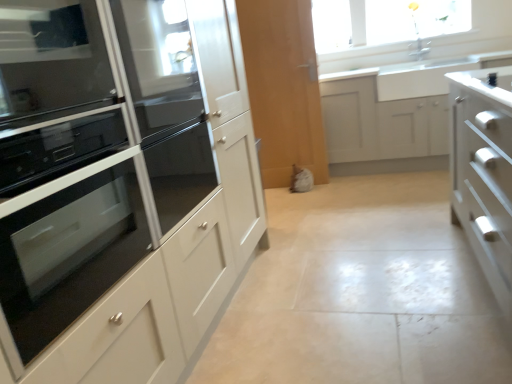
Question: Considering the relative sizes of white ceramic sink at upper right and matte white oven at left, the second cabinetry positioned from the back, in the image provided, is white ceramic sink at upper right smaller than matte white oven at left, the second cabinetry positioned from the back,?

Choices:
 (A) no
 (B) yes

Answer: (B)

Question: From the image's perspective, is white ceramic sink at upper right above matte white oven at left, which is counted as the second cabinetry, starting from the right?

Choices:
 (A) no
 (B) yes

Answer: (B)

Question: Would you consider white ceramic sink at upper right to be distant from matte white oven at left, which is counted as the second cabinetry, starting from the right?

Choices:
 (A) yes
 (B) no

Answer: (A)

Question: Is white ceramic sink at upper right wider than matte white oven at left, the 1th cabinetry from the left?

Choices:
 (A) no
 (B) yes

Answer: (B)

Question: From a real-world perspective, is white ceramic sink at upper right located higher than matte white oven at left, placed as the first cabinetry when sorted from front to back?

Choices:
 (A) no
 (B) yes

Answer: (A)

Question: From their relative heights in the image, would you say black glass oven at left is taller or shorter than black glass oven at left?

Choices:
 (A) tall
 (B) short

Answer: (A)

Question: Relative to black glass oven at left, is black glass oven at left in front or behind?

Choices:
 (A) behind
 (B) front

Answer: (B)

Question: Is black glass oven at left spatially inside black glass oven at left, or outside of it?

Choices:
 (A) outside
 (B) inside

Answer: (A)

Question: Is black glass oven at left to the left or to the right of black glass oven at left in the image?

Choices:
 (A) right
 (B) left

Answer: (A)

Question: Is black glass oven at left spatially inside white matte cabinet at center, acting as the 1th cabinetry starting from the back, or outside of it?

Choices:
 (A) outside
 (B) inside

Answer: (A)

Question: Is black glass oven at left to the left or to the right of white matte cabinet at center, positioned as the 2th cabinetry in front-to-back order, in the image?

Choices:
 (A) right
 (B) left

Answer: (B)

Question: From their relative heights in the image, would you say black glass oven at left is taller or shorter than white matte cabinet at center, positioned as the first cabinetry in right-to-left order?

Choices:
 (A) short
 (B) tall

Answer: (A)

Question: From the image's perspective, is black glass oven at left above or below white matte cabinet at center, positioned as the first cabinetry in right-to-left order?

Choices:
 (A) below
 (B) above

Answer: (A)

Question: Is white matte cabinet at center, positioned as the second cabinetry in left-to-right order, taller or shorter than black glass oven at left?

Choices:
 (A) tall
 (B) short

Answer: (A)

Question: Is white matte cabinet at center, acting as the 1th cabinetry starting from the back, in front of or behind black glass oven at left in the image?

Choices:
 (A) front
 (B) behind

Answer: (B)